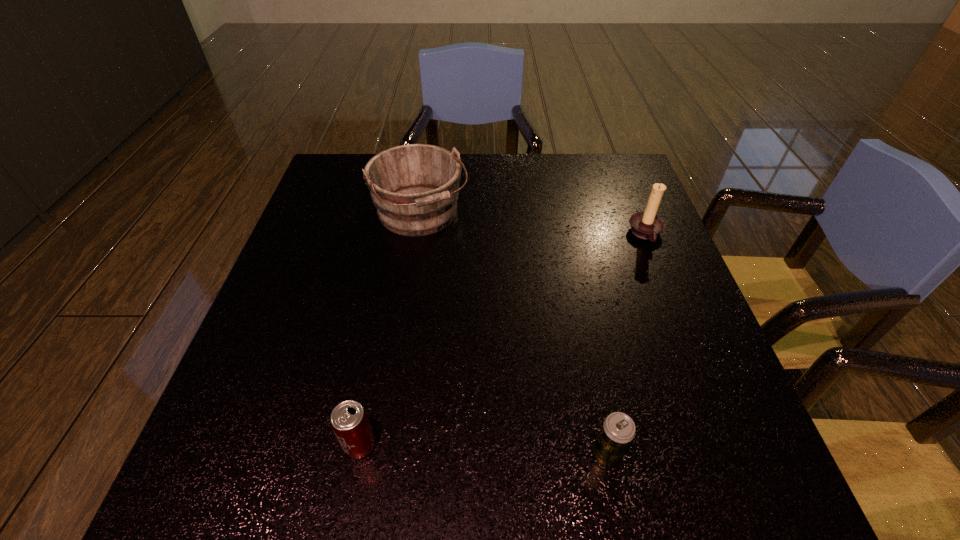
You are a GUI agent. You are given a task and a screenshot of the screen. Output one action in this format:
    pyautogui.click(x=<x>, y=<y>)
    Task: Click on the free space between the rightmost object and the wine bucket
    The image size is (960, 540).
    Given the screenshot: What is the action you would take?
    pyautogui.click(x=533, y=224)

The width and height of the screenshot is (960, 540). Identify the location of vacant space that's between the rightmost object and the left beer can. (503, 340).

Where is `vacant space in between the rightmost object and the wine bucket`? The height and width of the screenshot is (540, 960). vacant space in between the rightmost object and the wine bucket is located at coordinates (533, 224).

You are a GUI agent. You are given a task and a screenshot of the screen. Output one action in this format:
    pyautogui.click(x=<x>, y=<y>)
    Task: Click on the vacant space in between the wine bucket and the left beer can
    The height and width of the screenshot is (540, 960).
    Given the screenshot: What is the action you would take?
    pyautogui.click(x=391, y=330)

The width and height of the screenshot is (960, 540). In order to click on free space between the wine bucket and the left beer can in this screenshot , I will do `click(391, 330)`.

You are a GUI agent. You are given a task and a screenshot of the screen. Output one action in this format:
    pyautogui.click(x=<x>, y=<y>)
    Task: Click on the free area in between the wine bucket and the second object from right to left
    
    Given the screenshot: What is the action you would take?
    pyautogui.click(x=514, y=335)

Where is `vacant space that's between the right beer can and the wine bucket`? The height and width of the screenshot is (540, 960). vacant space that's between the right beer can and the wine bucket is located at coordinates (514, 335).

Where is `free area in between the rightmost object and the right beer can`? The image size is (960, 540). free area in between the rightmost object and the right beer can is located at coordinates (626, 345).

Where is `vacant space that's between the second object from right to left and the rightmost object`? This screenshot has height=540, width=960. vacant space that's between the second object from right to left and the rightmost object is located at coordinates (626, 345).

Point out which object is positioned as the second nearest to the right beer can. Please provide its 2D coordinates. Your answer should be formatted as a tuple, i.e. [(x, y)], where the tuple contains the x and y coordinates of a point satisfying the conditions above.

[(647, 225)]